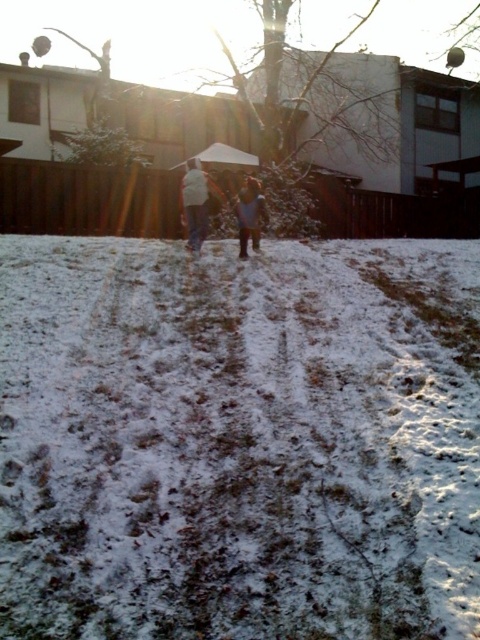
Question: Which object is farther from the camera taking this photo?

Choices:
 (A) blue denim jeans at center
 (B) white powdery snow at center
 (C) matte white hoodie at center
 (D) white matte umbrella at center

Answer: (D)

Question: Is the position of matte white hoodie at center more distant than that of white matte umbrella at center?

Choices:
 (A) no
 (B) yes

Answer: (A)

Question: Based on their relative distances, which object is farther from the matte white hoodie at center?

Choices:
 (A) white matte umbrella at center
 (B) white powdery snow at center

Answer: (A)

Question: Can you confirm if matte white hoodie at center is positioned to the right of white matte jacket at center?

Choices:
 (A) no
 (B) yes

Answer: (B)

Question: Can you confirm if white powdery snow at center is positioned to the right of white matte jacket at center?

Choices:
 (A) no
 (B) yes

Answer: (B)

Question: Which point is farther from the camera taking this photo?

Choices:
 (A) (210, 192)
 (B) (199, 248)
 (C) (259, 209)

Answer: (A)